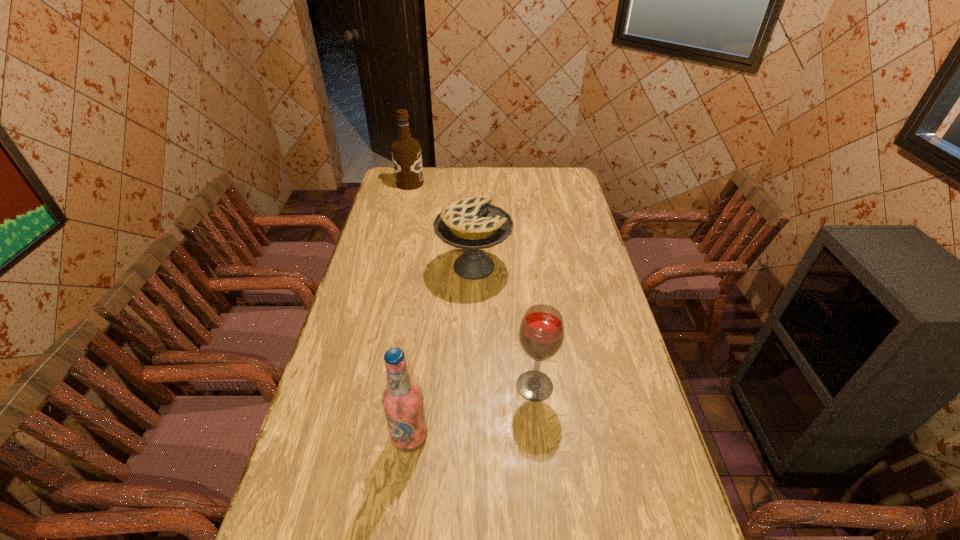
Image resolution: width=960 pixels, height=540 pixels. Identify the location of vacant space that satisfies the following two spatial constraints: 1. on the label of the leftmost object; 2. on the right side of the second alcohol from right to left. (348, 437).

Find the location of `free space that satisfies the following two spatial constraints: 1. on the cut side of the pie; 2. on the back side of the second nearest object`. free space that satisfies the following two spatial constraints: 1. on the cut side of the pie; 2. on the back side of the second nearest object is located at coordinates (472, 386).

You are a GUI agent. You are given a task and a screenshot of the screen. Output one action in this format:
    pyautogui.click(x=<x>, y=<y>)
    Task: Click on the vacant space that satisfies the following two spatial constraints: 1. on the label of the second nearest object; 2. on the right side of the leftmost object
    
    Given the screenshot: What is the action you would take?
    pyautogui.click(x=361, y=386)

At what (x,y) coordinates should I click in order to perform the action: click on free location that satisfies the following two spatial constraints: 1. on the back side of the rightmost alcohol; 2. on the label of the farthest alcohol. Please return your answer as a coordinate pair (x, y). This screenshot has width=960, height=540. Looking at the image, I should click on (513, 183).

Locate an element on the screen. This screenshot has width=960, height=540. blank area in the image that satisfies the following two spatial constraints: 1. on the back side of the second nearest alcohol; 2. on the cut side of the pie is located at coordinates (521, 267).

Locate an element on the screen. vacant area that satisfies the following two spatial constraints: 1. on the back side of the nearest object; 2. on the label of the farthest object is located at coordinates 443,183.

Locate an element on the screen. vacant area in the image that satisfies the following two spatial constraints: 1. on the label of the nearest object; 2. on the left side of the farthest object is located at coordinates (348, 437).

Find the location of a particular element. This screenshot has height=540, width=960. vacant space that satisfies the following two spatial constraints: 1. on the label of the nearest object; 2. on the right side of the farthest alcohol is located at coordinates (348, 437).

At what (x,y) coordinates should I click in order to perform the action: click on free location that satisfies the following two spatial constraints: 1. on the cut side of the second farthest object; 2. on the right side of the second farthest alcohol. Please return your answer as a coordinate pair (x, y). The width and height of the screenshot is (960, 540). Looking at the image, I should click on (472, 386).

I want to click on vacant space that satisfies the following two spatial constraints: 1. on the label of the farthest object; 2. on the back side of the rightmost alcohol, so click(361, 386).